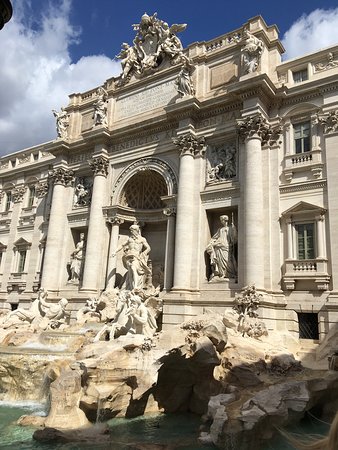
The width and height of the screenshot is (338, 450). I want to click on columns, so click(257, 196), click(184, 200), click(98, 202), click(55, 209).